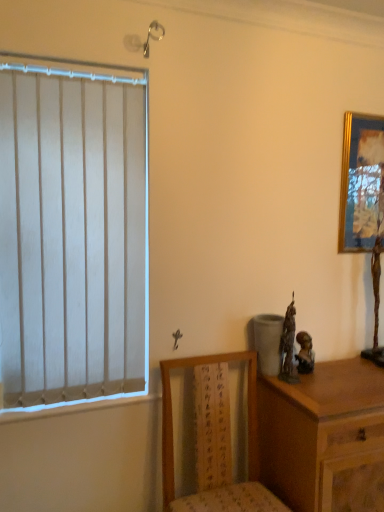
Measure the distance between wooden chair at lower center and camera.

The distance of wooden chair at lower center from camera is 1.55 meters.

Image resolution: width=384 pixels, height=512 pixels. Find the location of `gold-framed picture at upper right`. gold-framed picture at upper right is located at coordinates (361, 183).

At what (x,y) coordinates should I click in order to perform the action: click on wooden chest of drawers at right. Please return your answer as a coordinate pair (x, y). Image resolution: width=384 pixels, height=512 pixels. Looking at the image, I should click on (324, 437).

Measure the distance between point (x=356, y=437) and camera.

5.09 feet.

In order to click on wooden chair at lower center in this screenshot , I will do `click(214, 440)`.

Which object is thinner, matte bronze statue at right or wooden chest of drawers at right?

Thinner between the two is matte bronze statue at right.

Considering the relative sizes of matte bronze statue at right and wooden chest of drawers at right in the image provided, is matte bronze statue at right shorter than wooden chest of drawers at right?

Yes, matte bronze statue at right is shorter than wooden chest of drawers at right.

Does matte bronze statue at right have a larger size compared to wooden chest of drawers at right?

No, matte bronze statue at right is not bigger than wooden chest of drawers at right.

Would you say matte bronze statue at right contains wooden chest of drawers at right?

Actually, wooden chest of drawers at right is outside matte bronze statue at right.

Who is bigger, gold-framed picture at upper right or wooden chair at lower center?

Bigger between the two is wooden chair at lower center.

Which of these two, gold-framed picture at upper right or wooden chair at lower center, stands taller?

Standing taller between the two is wooden chair at lower center.

Does gold-framed picture at upper right turn towards wooden chair at lower center?

No, gold-framed picture at upper right does not turn towards wooden chair at lower center.

Is gold-framed picture at upper right not close to wooden chair at lower center?

No, gold-framed picture at upper right is not far from wooden chair at lower center.

Is wooden chest of drawers at right inside the boundaries of gold-framed picture at upper right, or outside?

wooden chest of drawers at right is not enclosed by gold-framed picture at upper right.

The height and width of the screenshot is (512, 384). I want to click on chest of drawers to the left of gold-framed picture at upper right, so click(324, 437).

Is wooden chest of drawers at right not inside wooden chair at lower center?

Absolutely, wooden chest of drawers at right is external to wooden chair at lower center.

From the image's perspective, is wooden chest of drawers at right above wooden chair at lower center?

No.

Which is more to the right, wooden chest of drawers at right or wooden chair at lower center?

wooden chest of drawers at right.

Looking at their sizes, would you say wooden chest of drawers at right is wider or thinner than wooden chair at lower center?

In the image, wooden chest of drawers at right appears to be more narrow than wooden chair at lower center.

Visually, is wooden chair at lower center positioned to the left or to the right of wooden chest of drawers at right?

wooden chair at lower center is to the left of wooden chest of drawers at right.

In the scene shown: From a real-world perspective, is wooden chair at lower center under wooden chest of drawers at right?

Actually, wooden chair at lower center is physically above wooden chest of drawers at right in the real world.

Is wooden chair at lower center positioned far away from wooden chest of drawers at right?

No, wooden chair at lower center is in close proximity to wooden chest of drawers at right.

How different are the orientations of wooden chair at lower center and wooden chest of drawers at right in degrees?

They differ by 0.38 degrees in their facing directions.

Would you say wooden chest of drawers at right is to the left or to the right of matte bronze statue at right in the picture?

From the image, it's evident that wooden chest of drawers at right is to the right of matte bronze statue at right.

How much distance is there between wooden chest of drawers at right and matte bronze statue at right?

wooden chest of drawers at right and matte bronze statue at right are 12.45 inches apart.

Is wooden chest of drawers at right positioned with its back to matte bronze statue at right?

wooden chest of drawers at right is not turned away from matte bronze statue at right.

Does point (312, 391) come closer to viewer compared to point (307, 346)?

Yes.

From the picture: Can you tell me how much gold-framed picture at upper right and matte bronze statue at right differ in facing direction?

22.5 degrees.

The width and height of the screenshot is (384, 512). There is a matte bronze statue at right. Find the location of `picture frame above it (from a real-world perspective)`. picture frame above it (from a real-world perspective) is located at coordinates (361, 183).

Is gold-framed picture at upper right inside or outside of matte bronze statue at right?

gold-framed picture at upper right is not inside matte bronze statue at right, it's outside.

Who is bigger, gold-framed picture at upper right or matte bronze statue at right?

Bigger between the two is gold-framed picture at upper right.

Image resolution: width=384 pixels, height=512 pixels. Identify the location of the chest of drawers that appears in front of the matte bronze statue at right. (324, 437).

The image size is (384, 512). In order to click on picture frame behind the wooden chair at lower center in this screenshot , I will do `click(361, 183)`.

Based on their spatial positions, is wooden chair at lower center or gold-framed picture at upper right further from wooden chest of drawers at right?

gold-framed picture at upper right is further to wooden chest of drawers at right.

From the image, which object appears to be farther from matte bronze statue at right, wooden chest of drawers at right or gold-framed picture at upper right?

gold-framed picture at upper right.

Looking at the image, which one is located further to wooden chair at lower center, wooden chest of drawers at right or gold-framed picture at upper right?

gold-framed picture at upper right is positioned further to the anchor wooden chair at lower center.

Considering their positions, is wooden chest of drawers at right positioned closer to wooden chair at lower center than matte bronze statue at right?

wooden chest of drawers at right.

When comparing their distances from wooden chair at lower center, does gold-framed picture at upper right or matte bronze statue at right seem closer?

matte bronze statue at right lies closer to wooden chair at lower center than the other object.

Which object lies nearer to the anchor point wooden chest of drawers at right, gold-framed picture at upper right or wooden chair at lower center?

The object closer to wooden chest of drawers at right is wooden chair at lower center.

From the image, which object appears to be nearer to wooden chest of drawers at right, wooden chair at lower center or matte bronze statue at right?

Among the two, wooden chair at lower center is located nearer to wooden chest of drawers at right.

Estimate the real-world distances between objects in this image. Which object is closer to gold-framed picture at upper right, wooden chair at lower center or wooden chest of drawers at right?

wooden chest of drawers at right is positioned closer to the anchor gold-framed picture at upper right.

Find the location of a particular element. figurine between gold-framed picture at upper right and wooden chair at lower center from top to bottom is located at coordinates (305, 353).

This screenshot has width=384, height=512. What are the coordinates of `chest of drawers between wooden chair at lower center and matte bronze statue at right from front to back` in the screenshot? It's located at (324, 437).

Locate an element on the screen. Image resolution: width=384 pixels, height=512 pixels. figurine between gold-framed picture at upper right and wooden chest of drawers at right from top to bottom is located at coordinates (305, 353).

Find the location of a particular element. chair between gold-framed picture at upper right and wooden chest of drawers at right from top to bottom is located at coordinates (214, 440).